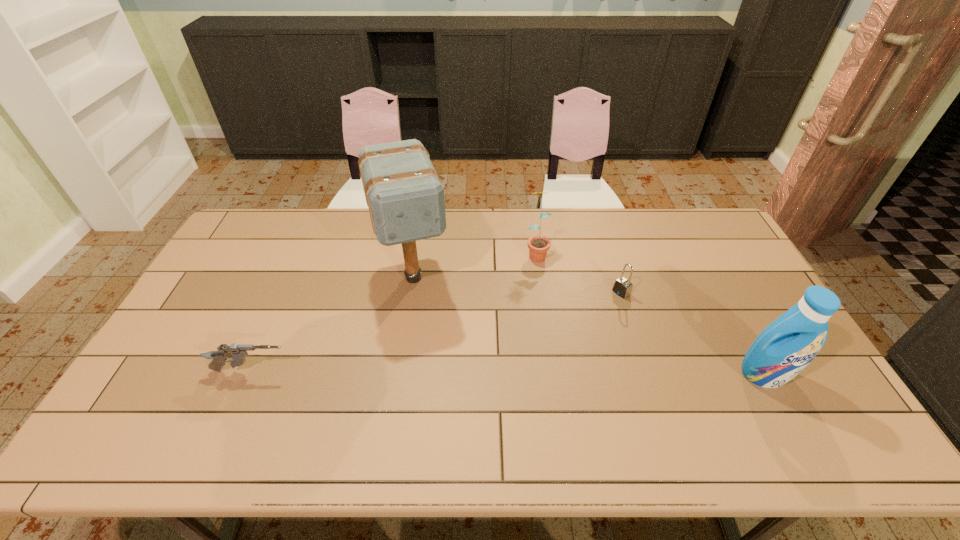
Identify the location of free space located 0.190m on the shackle of the padlock. (572, 325).

What are the coordinates of `vacant region located on the shackle of the padlock` in the screenshot? It's located at (540, 347).

Image resolution: width=960 pixels, height=540 pixels. I want to click on free spot located 0.130m on the shackle of the padlock, so click(587, 316).

Identify the location of free spot located 0.260m on the flower of the sunflower. pyautogui.click(x=557, y=324).

Locate an element on the screen. This screenshot has width=960, height=540. free space located on the flower of the sunflower is located at coordinates (557, 324).

Find the location of `vacant space located 0.130m on the flower of the sunflower`. vacant space located 0.130m on the flower of the sunflower is located at coordinates (547, 292).

Locate an element on the screen. The image size is (960, 540). free spot located 0.130m on the striking surface of the second object from left to right is located at coordinates coord(431,344).

You are a GUI agent. You are given a task and a screenshot of the screen. Output one action in this format:
    pyautogui.click(x=<x>, y=<y>)
    Task: Click on the vacant area situated on the striking surface of the second object from left to right
    Image resolution: width=960 pixels, height=540 pixels.
    Given the screenshot: What is the action you would take?
    pyautogui.click(x=442, y=379)

This screenshot has height=540, width=960. I want to click on free region located 0.150m on the striking surface of the second object from left to right, so click(433, 349).

You are a GUI agent. You are given a task and a screenshot of the screen. Output one action in this format:
    pyautogui.click(x=<x>, y=<y>)
    Task: Click on the sunflower that is positioned at the far edge
    The height and width of the screenshot is (540, 960).
    Given the screenshot: What is the action you would take?
    pyautogui.click(x=538, y=245)